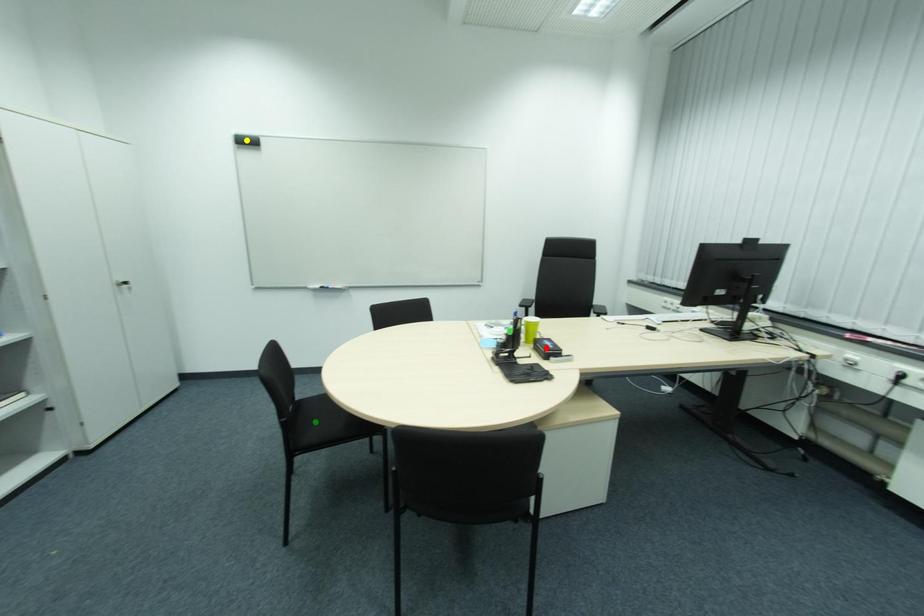
Order these from nearest to farthest:
yellow point, green point, red point

1. yellow point
2. red point
3. green point